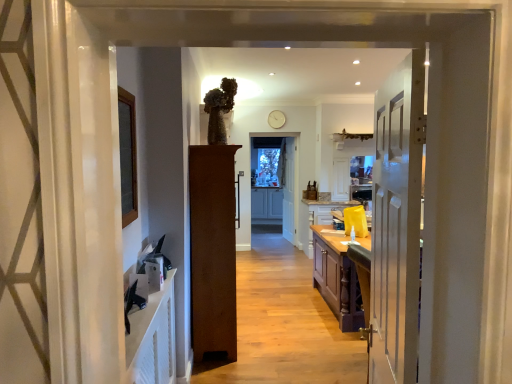
What do you see at coordinates (266, 203) in the screenshot? I see `matte gray cabinetry at center, acting as the second cabinetry starting from the front` at bounding box center [266, 203].

Describe the element at coordinates (287, 186) in the screenshot. I see `white wooden door at center, positioned as the third door in front-to-back order` at that location.

The image size is (512, 384). Find the location of `white glossy cabinet at center`. white glossy cabinet at center is located at coordinates (275, 186).

From a real-world perspective, does white glossy cabinet at center sit lower than white painted wood door at right, marked as the second door in a left-to-right arrangement?

Correct, in the physical world, white glossy cabinet at center is lower than white painted wood door at right, marked as the second door in a left-to-right arrangement.

Which is closer to the camera, (x=273, y=151) or (x=401, y=262)?

Point (x=273, y=151) is farther from the camera than point (x=401, y=262).

Between white glossy cabinet at center and white painted wood door at right, marked as the second door in a left-to-right arrangement, which one is positioned in front?

Positioned in front is white painted wood door at right, marked as the second door in a left-to-right arrangement.

From the picture: Is white wooden door at center, positioned as the third door in front-to-back order, further to camera compared to white painted wood door at right, marked as the second door in a left-to-right arrangement?

Yes.

Considering the relative sizes of white wooden door at center, marked as the 1th door in a back-to-front arrangement, and white painted wood door at right, which is counted as the third door, starting from the back, in the image provided, is white wooden door at center, marked as the 1th door in a back-to-front arrangement, wider than white painted wood door at right, which is counted as the third door, starting from the back,?

In fact, white wooden door at center, marked as the 1th door in a back-to-front arrangement, might be narrower than white painted wood door at right, which is counted as the third door, starting from the back.

Does white wooden door at center, positioned as the third door in front-to-back order, turn towards white painted wood door at right, marked as the second door in a left-to-right arrangement?

No, white wooden door at center, positioned as the third door in front-to-back order, is not oriented towards white painted wood door at right, marked as the second door in a left-to-right arrangement.

From the image's perspective, who appears lower, white wooden door at center, positioned as the third door in front-to-back order, or white painted wood door at right, which ranks as the 2th door in right-to-left order?

white painted wood door at right, which ranks as the 2th door in right-to-left order.

In terms of height, does brown wood cabinet at center, which appears as the first door when viewed from the left, look taller or shorter compared to wooden floor at center?

brown wood cabinet at center, which appears as the first door when viewed from the left, is taller than wooden floor at center.

From the image's perspective, is brown wood cabinet at center, which appears as the first door when viewed from the left, over wooden floor at center?

Correct, brown wood cabinet at center, which appears as the first door when viewed from the left, appears higher than wooden floor at center in the image.

Looking at this image, considering the relative positions of brown wood cabinet at center, the second door when ordered from front to back, and wooden floor at center in the image provided, is brown wood cabinet at center, the second door when ordered from front to back, behind wooden floor at center?

Yes, brown wood cabinet at center, the second door when ordered from front to back, is behind wooden floor at center.

From a real-world perspective, relative to wooden floor at center, is brown wood cabinet at center, which appears as the 3th door when viewed from the right, vertically above or below?

Clearly, from a real-world perspective, brown wood cabinet at center, which appears as the 3th door when viewed from the right, is above wooden floor at center.

Based on the photo, from a real-world perspective, who is located higher, white glossy cabinet at center or wooden floor at center?

white glossy cabinet at center is physically above.

Is white glossy cabinet at center shorter than wooden floor at center?

Incorrect, the height of white glossy cabinet at center does not fall short of that of wooden floor at center.

From the picture: Does white glossy cabinet at center touch wooden floor at center?

There is a gap between white glossy cabinet at center and wooden floor at center.

Does white wooden door at center, marked as the 1th door in a back-to-front arrangement, appear on the left side of matte gray cabinetry at center, which is counted as the first cabinetry, starting from the left?

No.

How many degrees apart are the facing directions of white wooden door at center, positioned as the third door in front-to-back order, and matte gray cabinetry at center, acting as the second cabinetry starting from the front?

The angular difference between white wooden door at center, positioned as the third door in front-to-back order, and matte gray cabinetry at center, acting as the second cabinetry starting from the front, is 73.8 degrees.

Considering the positions of objects white wooden door at center, the third door in the left-to-right sequence, and matte gray cabinetry at center, acting as the 1th cabinetry starting from the back, in the image provided, who is behind, white wooden door at center, the third door in the left-to-right sequence, or matte gray cabinetry at center, acting as the 1th cabinetry starting from the back,?

Positioned behind is matte gray cabinetry at center, acting as the 1th cabinetry starting from the back.

Is white wooden door at center, positioned as the third door in front-to-back order, taller or shorter than brown wood cabinet at center, which is counted as the 2th door, starting from the back?

white wooden door at center, positioned as the third door in front-to-back order, is taller than brown wood cabinet at center, which is counted as the 2th door, starting from the back.

Between white wooden door at center, the 1th door when ordered from right to left, and brown wood cabinet at center, which appears as the first door when viewed from the left, which one is positioned behind?

white wooden door at center, the 1th door when ordered from right to left, is further away from the camera.

Is white wooden door at center, marked as the 1th door in a back-to-front arrangement, completely or partially outside of brown wood cabinet at center, which appears as the first door when viewed from the left?

white wooden door at center, marked as the 1th door in a back-to-front arrangement, is positioned outside brown wood cabinet at center, which appears as the first door when viewed from the left.

Is brown wood cabinet at center, which is counted as the 2th door, starting from the back, positioned far away from matte gray cabinetry at center, acting as the 1th cabinetry starting from the back?

Yes, brown wood cabinet at center, which is counted as the 2th door, starting from the back, is far from matte gray cabinetry at center, acting as the 1th cabinetry starting from the back.

In terms of width, does brown wood cabinet at center, which appears as the 3th door when viewed from the right, look wider or thinner when compared to matte gray cabinetry at center, acting as the second cabinetry starting from the front?

Considering their sizes, brown wood cabinet at center, which appears as the 3th door when viewed from the right, looks broader than matte gray cabinetry at center, acting as the second cabinetry starting from the front.

Is brown wood cabinet at center, which appears as the first door when viewed from the left, at the left side of matte gray cabinetry at center, acting as the 1th cabinetry starting from the back?

Indeed, brown wood cabinet at center, which appears as the first door when viewed from the left, is positioned on the left side of matte gray cabinetry at center, acting as the 1th cabinetry starting from the back.

From the image's perspective, is brown wood cabinet at center, which appears as the 3th door when viewed from the right, located above matte gray cabinetry at center, acting as the second cabinetry starting from the front?

No, from the image's perspective, brown wood cabinet at center, which appears as the 3th door when viewed from the right, is not on top of matte gray cabinetry at center, acting as the second cabinetry starting from the front.

Starting from the white glossy cabinet at center, which door is the 2nd one in front? Please provide its 2D coordinates.

[(397, 222)]

Identify the location of door on the right of the white painted wood door at right, which appears as the 1th door when viewed from the front. (287, 186).

Looking at the image, which one is located further to white glossy cabinet at center, white painted wood door at right, which appears as the 1th door when viewed from the front, or brown wood cabinet at center, the second door when ordered from front to back?

Among the two, white painted wood door at right, which appears as the 1th door when viewed from the front, is located further to white glossy cabinet at center.

Looking at the image, which one is located closer to matte gray cabinetry at center, acting as the second cabinetry starting from the front, brown wood cabinet at center, the second door when ordered from front to back, or white wooden door at center, the 1th door when ordered from right to left?

white wooden door at center, the 1th door when ordered from right to left.

Which object lies nearer to the anchor point brown wood cabinet at center, which is counted as the 2th door, starting from the back, white glossy cabinet at center or yellow matte cabinet at center, marked as the first cabinetry in a front-to-back arrangement?

Based on the image, yellow matte cabinet at center, marked as the first cabinetry in a front-to-back arrangement, appears to be nearer to brown wood cabinet at center, which is counted as the 2th door, starting from the back.

Considering their positions, is white wooden door at center, the third door in the left-to-right sequence, positioned further to matte gray cabinetry at center, acting as the second cabinetry starting from the front, than white painted wood door at right, which ranks as the 2th door in right-to-left order?

white painted wood door at right, which ranks as the 2th door in right-to-left order, lies further to matte gray cabinetry at center, acting as the second cabinetry starting from the front, than the other object.

Estimate the real-world distances between objects in this image. Which object is closer to wooden floor at center, white painted wood door at right, which ranks as the 2th door in right-to-left order, or white glossy cabinet at center?

Based on the image, white painted wood door at right, which ranks as the 2th door in right-to-left order, appears to be nearer to wooden floor at center.

Estimate the real-world distances between objects in this image. Which object is further from yellow matte cabinet at center, the first cabinetry viewed from the right, white painted wood door at right, marked as the second door in a left-to-right arrangement, or white wooden door at center, the third door in the left-to-right sequence?

The object further to yellow matte cabinet at center, the first cabinetry viewed from the right, is white painted wood door at right, marked as the second door in a left-to-right arrangement.

Based on their spatial positions, is white glossy cabinet at center or brown wood cabinet at center, which is counted as the 2th door, starting from the back, closer to yellow matte cabinet at center, placed as the second cabinetry when sorted from back to front?

Based on the image, white glossy cabinet at center appears to be nearer to yellow matte cabinet at center, placed as the second cabinetry when sorted from back to front.

Based on their spatial positions, is white wooden door at center, positioned as the third door in front-to-back order, or yellow matte cabinet at center, the first cabinetry viewed from the right, further from white painted wood door at right, which appears as the 1th door when viewed from the front?

white wooden door at center, positioned as the third door in front-to-back order.

Where is `screen door between brown wood cabinet at center, the second door when ordered from front to back, and matte gray cabinetry at center, acting as the second cabinetry starting from the front, along the z-axis`? The width and height of the screenshot is (512, 384). screen door between brown wood cabinet at center, the second door when ordered from front to back, and matte gray cabinetry at center, acting as the second cabinetry starting from the front, along the z-axis is located at coordinates (275, 186).

Where is `screen door between white painted wood door at right, which ranks as the 2th door in right-to-left order, and white wooden door at center, the 1th door when ordered from right to left, in the front-back direction`? screen door between white painted wood door at right, which ranks as the 2th door in right-to-left order, and white wooden door at center, the 1th door when ordered from right to left, in the front-back direction is located at coordinates (275, 186).

Find the location of `path between white painted wood door at right, marked as the second door in a left-to-right arrangement, and brown wood cabinet at center, which appears as the 3th door when viewed from the right, along the z-axis`. path between white painted wood door at right, marked as the second door in a left-to-right arrangement, and brown wood cabinet at center, which appears as the 3th door when viewed from the right, along the z-axis is located at coordinates (284, 323).

At what (x,y) coordinates should I click in order to perform the action: click on screen door located between wooden floor at center and matte gray cabinetry at center, which is counted as the first cabinetry, starting from the left, in the depth direction. Please return your answer as a coordinate pair (x, y). This screenshot has width=512, height=384. Looking at the image, I should click on (275, 186).